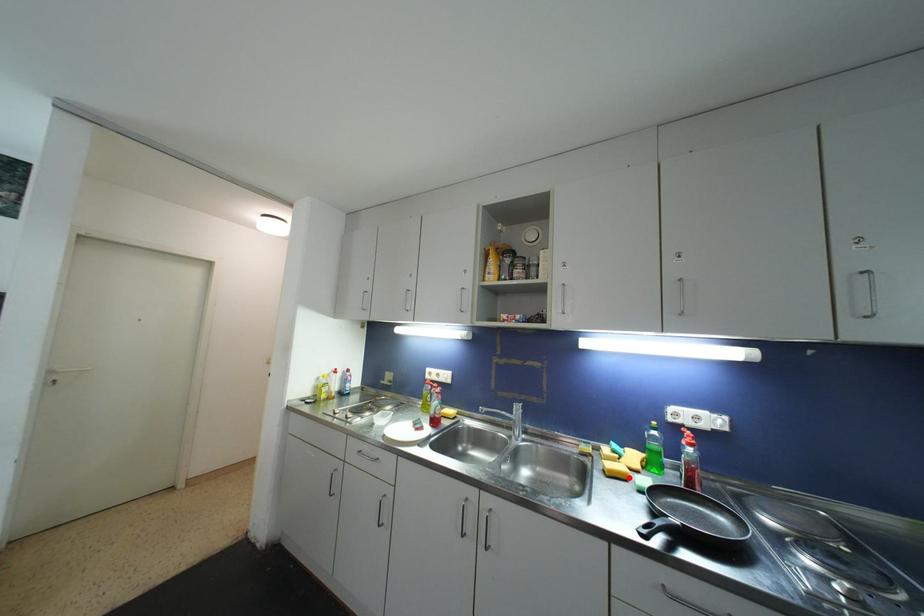
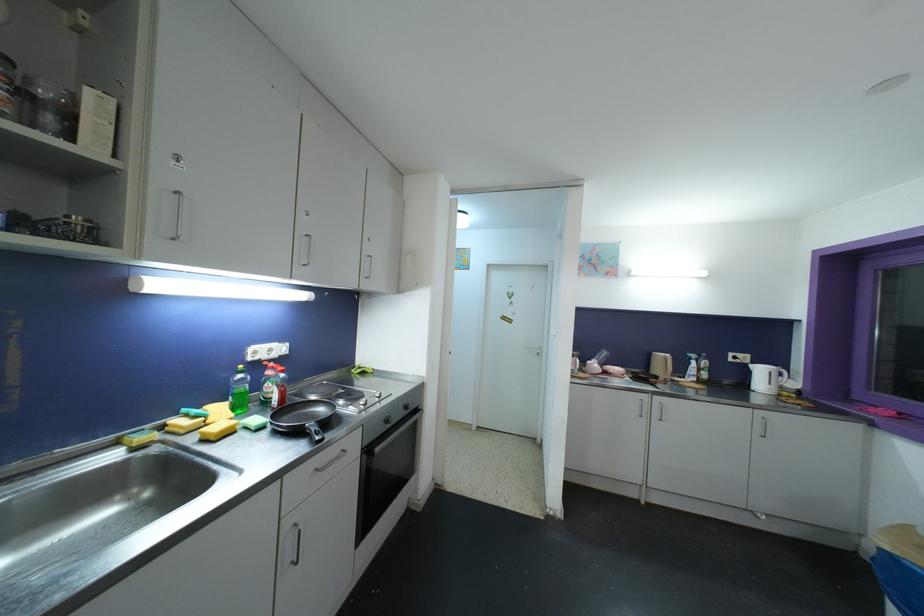
Question: I am providing you with two images of the same scene from different viewpoints. A red point is marked on the first image. At the location where the point appears in image 1, is it still visible in image 2?

Choices:
 (A) Yes
 (B) No

Answer: (A)